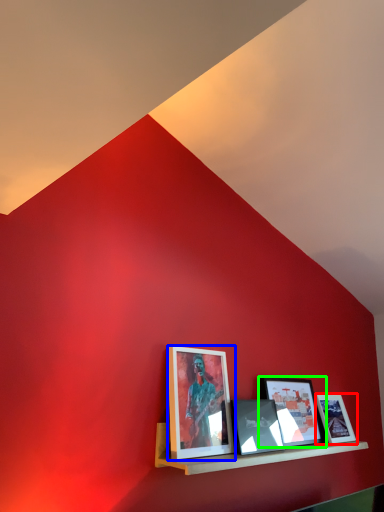
Question: Which object is positioned farthest from picture frame (highlighted by a red box)? Select from picture frame (highlighted by a blue box) and picture frame (highlighted by a green box).

Choices:
 (A) picture frame
 (B) picture frame

Answer: (A)